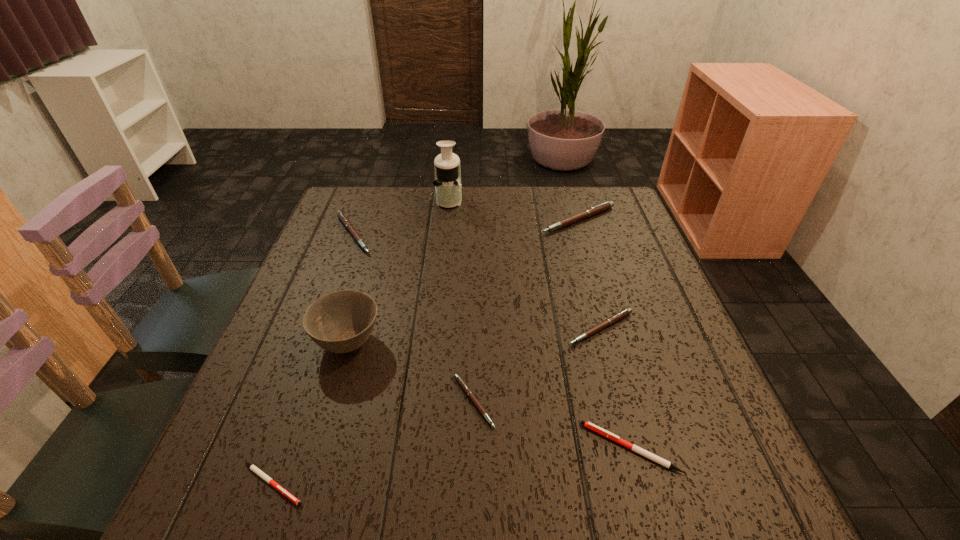
At what (x,y) coordinates should I click in order to perform the action: click on free space between the fourth pen from right to left and the shortest pen. Please return your answer as a coordinate pair (x, y). The height and width of the screenshot is (540, 960). Looking at the image, I should click on click(x=373, y=443).

At what (x,y) coordinates should I click in order to perform the action: click on free space that is in between the sixth shortest object and the fourth shortest pen. Please return your answer as a coordinate pair (x, y). Image resolution: width=960 pixels, height=540 pixels. Looking at the image, I should click on (589, 274).

You are a GUI agent. You are given a task and a screenshot of the screen. Output one action in this format:
    pyautogui.click(x=<x>, y=<y>)
    Task: Click on the empty space that is in between the shortest object and the fifth tallest object
    Image resolution: width=960 pixels, height=540 pixels.
    Given the screenshot: What is the action you would take?
    pyautogui.click(x=437, y=406)

Identify the location of vacant space in between the nearest pink pen and the shortest object. (373, 443).

Locate an element on the screen. free space between the biggest pink pen and the seventh shortest object is located at coordinates (463, 281).

Identify the location of object that is the fifth closest to the biggest pink pen. Image resolution: width=960 pixels, height=540 pixels. tap(463, 385).

The height and width of the screenshot is (540, 960). What are the coordinates of `object that is the fifth nearest to the shortest pen` in the screenshot? It's located at (342, 217).

Find the location of a particular element. The height and width of the screenshot is (540, 960). the fourth closest pen to the third pen from left to right is located at coordinates (342, 217).

Select which pen is the second closest to the biggest pink pen. Please provide its 2D coordinates. Your answer should be formatted as a tuple, i.e. [(x, y)], where the tuple contains the x and y coordinates of a point satisfying the conditions above.

[(342, 217)]

Choose which pink pen is the second nearest neighbor to the tallest pen. Please provide its 2D coordinates. Your answer should be formatted as a tuple, i.e. [(x, y)], where the tuple contains the x and y coordinates of a point satisfying the conditions above.

[(342, 217)]